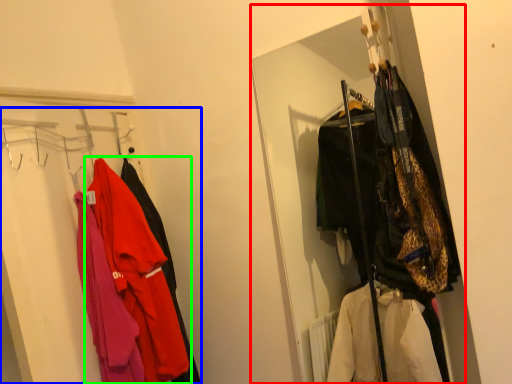
Question: Which is nearer to the closet (highlighted by a red box)? closet (highlighted by a blue box) or jacket (highlighted by a green box).

Choices:
 (A) closet
 (B) jacket

Answer: (A)